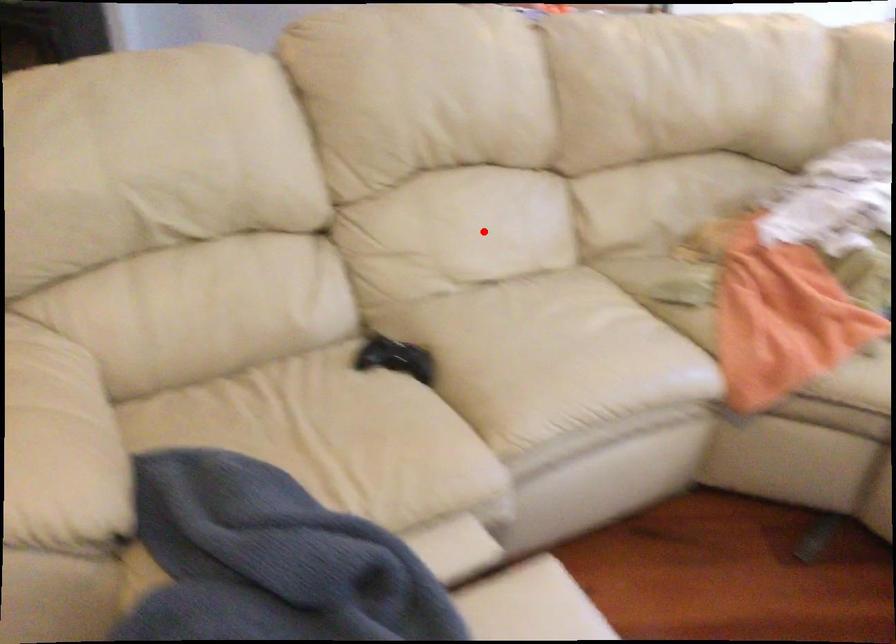
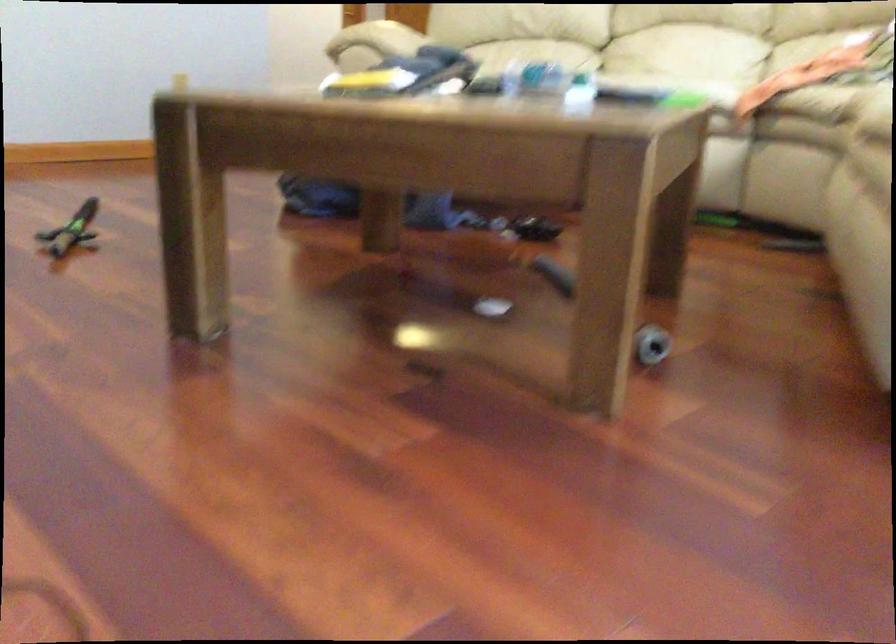
In the second image, find the point that corresponds to the highlighted location in the first image.

(686, 59)